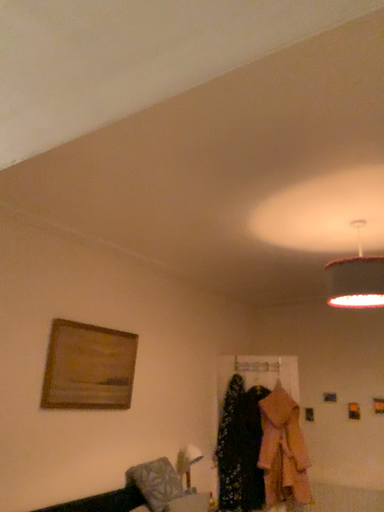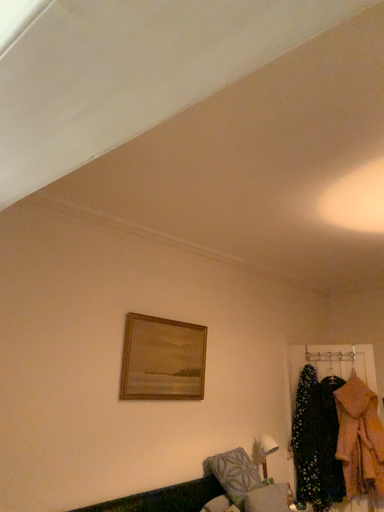
Question: Which way did the camera rotate in the video?

Choices:
 (A) rotated left
 (B) rotated right

Answer: (A)